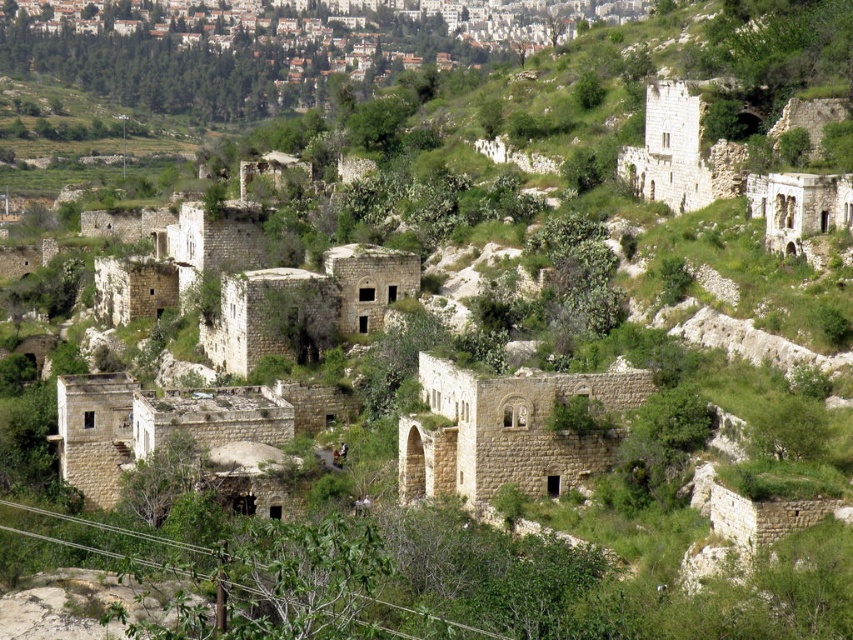
You are an archaeologist examining the ancient stone structures in the image. You need to determine which object is smaller in size between the beige stone ruins at center and the stone archway at upper right. Which one is it?

The beige stone ruins at center has a smaller size compared to the stone archway at upper right, so the beige stone ruins at center is the smaller one.